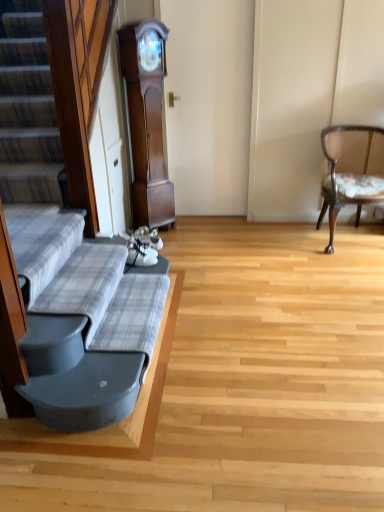
Describe the element at coordinates (147, 120) in the screenshot. I see `dark wood grandfather clock at center` at that location.

At what (x,y) coordinates should I click in order to perform the action: click on wooden upholstered chair at right. Please return your answer as a coordinate pair (x, y). The image size is (384, 512). Looking at the image, I should click on (350, 169).

Looking at the image, does plaid fabric couch at left seem bigger or smaller compared to dark wood grandfather clock at center?

Considering their sizes, plaid fabric couch at left takes up less space than dark wood grandfather clock at center.

Which is correct: plaid fabric couch at left is inside dark wood grandfather clock at center, or outside of it?

plaid fabric couch at left is not inside dark wood grandfather clock at center, it's outside.

How different are the orientations of plaid fabric couch at left and dark wood grandfather clock at center in degrees?

There is a 45.3-degree angle between the facing directions of plaid fabric couch at left and dark wood grandfather clock at center.

Is plaid fabric couch at left to the left or to the right of dark wood grandfather clock at center in the image?

In the image, plaid fabric couch at left appears on the left side of dark wood grandfather clock at center.

Is dark wood grandfather clock at center closer to the viewer compared to plaid fabric couch at left?

No, dark wood grandfather clock at center is further to the viewer.

This screenshot has height=512, width=384. Find the location of `couch below the dark wood grandfather clock at center (from the image's perspective)`. couch below the dark wood grandfather clock at center (from the image's perspective) is located at coordinates (74, 322).

Based on the photo, does dark wood grandfather clock at center turn towards plaid fabric couch at left?

No, dark wood grandfather clock at center is not turned towards plaid fabric couch at left.

What's the angular difference between dark wood grandfather clock at center and plaid fabric couch at left's facing directions?

dark wood grandfather clock at center and plaid fabric couch at left are facing 45.3 degrees away from each other.

Can you tell me how much wooden upholstered chair at right and dark wood grandfather clock at center differ in facing direction?

33.9 degrees separate the facing orientations of wooden upholstered chair at right and dark wood grandfather clock at center.

Where is `chair below the dark wood grandfather clock at center (from the image's perspective)`? chair below the dark wood grandfather clock at center (from the image's perspective) is located at coordinates (350, 169).

Is wooden upholstered chair at right wider or thinner than dark wood grandfather clock at center?

Clearly, wooden upholstered chair at right has more width compared to dark wood grandfather clock at center.

Does wooden upholstered chair at right come behind dark wood grandfather clock at center?

That is False.

At what (x,y) coordinates should I click in order to perform the action: click on cabinetry behind the wooden upholstered chair at right. Please return your answer as a coordinate pair (x, y). Looking at the image, I should click on (147, 120).

Does dark wood grandfather clock at center have a greater height compared to wooden upholstered chair at right?

Indeed, dark wood grandfather clock at center has a greater height compared to wooden upholstered chair at right.

Is dark wood grandfather clock at center inside or outside of wooden upholstered chair at right?

dark wood grandfather clock at center exists outside the volume of wooden upholstered chair at right.

Is wooden upholstered chair at right spatially inside plaid fabric couch at left, or outside of it?

wooden upholstered chair at right is outside plaid fabric couch at left.

Can you confirm if wooden upholstered chair at right is bigger than plaid fabric couch at left?

Yes, wooden upholstered chair at right is bigger than plaid fabric couch at left.

Image resolution: width=384 pixels, height=512 pixels. Find the location of `couch below the wooden upholstered chair at right (from a real-world perspective)`. couch below the wooden upholstered chair at right (from a real-world perspective) is located at coordinates (74, 322).

Is plaid fabric couch at left far away from wooden upholstered chair at right?

That's right, there is a large distance between plaid fabric couch at left and wooden upholstered chair at right.

Relative to wooden upholstered chair at right, is plaid fabric couch at left in front or behind?

Clearly, plaid fabric couch at left is in front of wooden upholstered chair at right.

Between point (35, 322) and point (331, 186), which one is positioned behind?

The point (331, 186) is farther from the camera.

Between plaid fabric couch at left and wooden upholstered chair at right, which one appears on the right side from the viewer's perspective?

wooden upholstered chair at right.

Find the location of a particular element. couch lying in front of the dark wood grandfather clock at center is located at coordinates (74, 322).

This screenshot has width=384, height=512. I want to click on cabinetry above the plaid fabric couch at left (from a real-world perspective), so click(x=147, y=120).

When comparing their distances from dark wood grandfather clock at center, does plaid fabric couch at left or wooden upholstered chair at right seem closer?

wooden upholstered chair at right is positioned closer to the anchor dark wood grandfather clock at center.

Estimate the real-world distances between objects in this image. Which object is further from dark wood grandfather clock at center, wooden upholstered chair at right or plaid fabric couch at left?

plaid fabric couch at left is positioned further to the anchor dark wood grandfather clock at center.

In the scene shown: Based on their spatial positions, is dark wood grandfather clock at center or plaid fabric couch at left further from wooden upholstered chair at right?

plaid fabric couch at left lies further to wooden upholstered chair at right than the other object.

Consider the image. When comparing their distances from plaid fabric couch at left, does wooden upholstered chair at right or dark wood grandfather clock at center seem closer?

Based on the image, dark wood grandfather clock at center appears to be nearer to plaid fabric couch at left.

Based on their spatial positions, is dark wood grandfather clock at center or wooden upholstered chair at right closer to plaid fabric couch at left?

Among the two, dark wood grandfather clock at center is located nearer to plaid fabric couch at left.

Looking at the image, which one is located further to wooden upholstered chair at right, plaid fabric couch at left or dark wood grandfather clock at center?

plaid fabric couch at left.

You are a GUI agent. You are given a task and a screenshot of the screen. Output one action in this format:
    pyautogui.click(x=<x>, y=<y>)
    Task: Click on the cabinetry between plaid fabric couch at left and wooden upholstered chair at right
    The width and height of the screenshot is (384, 512).
    Given the screenshot: What is the action you would take?
    pyautogui.click(x=147, y=120)